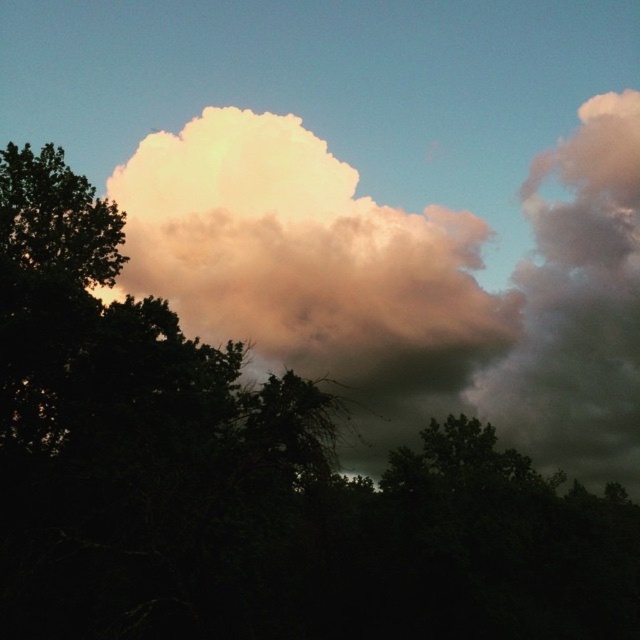
Is white fluffy cloud at upper center below cloudy gray cloud at upper right?

No, white fluffy cloud at upper center is not below cloudy gray cloud at upper right.

Locate an element on the screen. The height and width of the screenshot is (640, 640). white fluffy cloud at upper center is located at coordinates (298, 250).